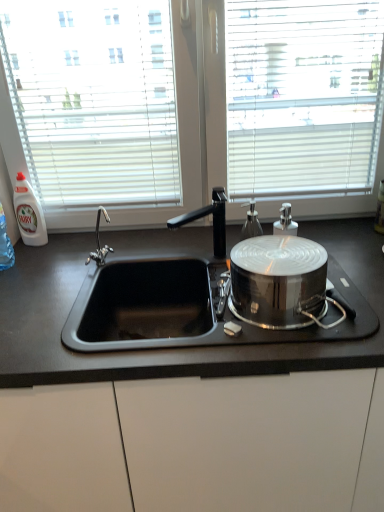
Question: Considering the positions of black matte faucet at center and black matte countertop at center in the image, is black matte faucet at center bigger or smaller than black matte countertop at center?

Choices:
 (A) small
 (B) big

Answer: (A)

Question: From the image's perspective, is black matte faucet at center located above or below black matte countertop at center?

Choices:
 (A) above
 (B) below

Answer: (A)

Question: Estimate the real-world distances between objects in this image. Which object is farther from the polished stainless steel pot at right?

Choices:
 (A) black matte faucet at center
 (B) white plastic bottle at left, the 2th bottle in the front-to-back sequence
 (C) black matte countertop at center
 (D) satin silver soap dispenser at center, marked as the 1th bottle in a right-to-left arrangement

Answer: (B)

Question: Which of these objects is positioned closest to the black matte faucet at center?

Choices:
 (A) white plastic bottle at left, marked as the 2th bottle in a right-to-left arrangement
 (B) polished stainless steel pot at right
 (C) satin silver soap dispenser at center, the 2th bottle when ordered from back to front
 (D) black matte countertop at center

Answer: (C)